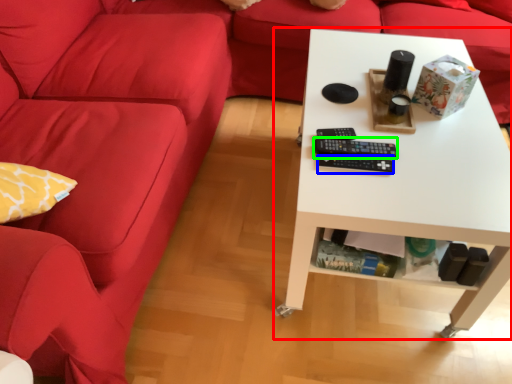
Question: Which object is positioned farthest from table (highlighted by a red box)? Select from control (highlighted by a blue box) and control (highlighted by a green box).

Choices:
 (A) control
 (B) control

Answer: (A)